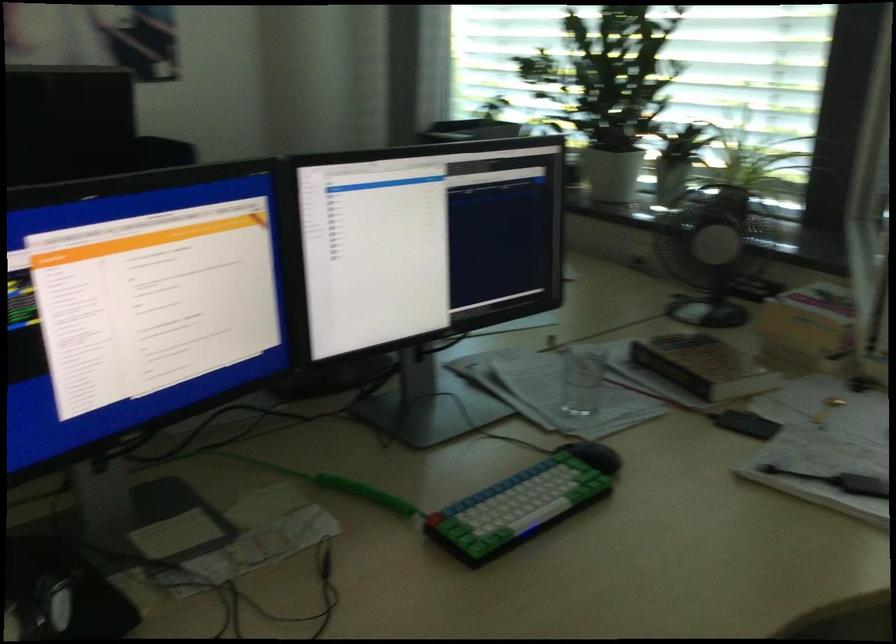
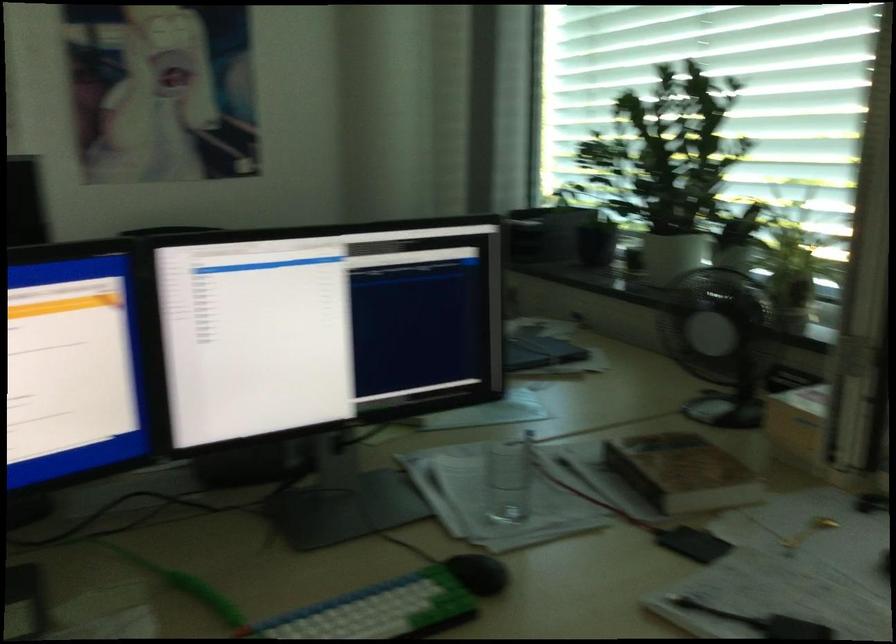
Question: The images are taken continuously from a first-person perspective. In which direction is your viewpoint rotating?

Choices:
 (A) Left
 (B) Right
 (C) Up
 (D) Down

Answer: (A)